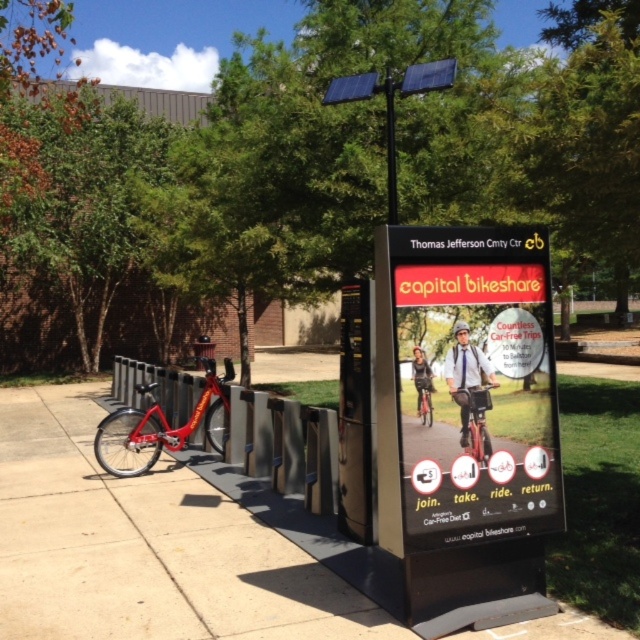
You are a delivery person who needs to choose between the two bicycles at the Capital Bikeshare station. The red matte bicycle at center and the metallic red bicycle at center are both available. Which one should you pick if you need a bike that is taller?

You should pick the red matte bicycle at center because it is much taller than the metallic red bicycle at center.

You are a tourist at the Capital Bikeshare station. You need to locate the advertisement board to learn how to rent a bike. Which object is positioned higher between the metallic sign at center and the metallic red bicycle at center?

The metallic red bicycle at center is positioned higher than the metallic sign at center, so the advertisement board is likely the metallic red bicycle at center.

From the picture: You are a delivery person needing to choose a bike from the Capital Bikeshare station at Thomas Jefferson Community Center. The station has a red matte bicycle at center and a metallic red bicycle at center. Which bike is wider?

The red matte bicycle at center is wider than the metallic red bicycle at center according to the description.